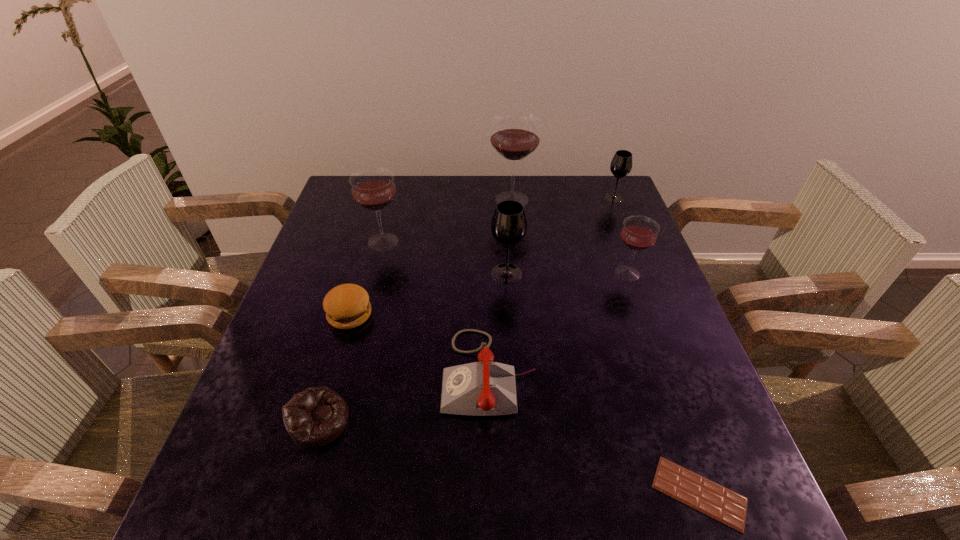
Where is `beanbag present at the left edge`? The height and width of the screenshot is (540, 960). beanbag present at the left edge is located at coordinates (315, 417).

Identify the location of chocolate bar located in the right edge section of the desktop. This screenshot has height=540, width=960. (718, 502).

Identify the location of object at the far right corner. The image size is (960, 540). (621, 164).

Identify the location of object located in the near right corner section of the desktop. (718, 502).

I want to click on vacant space at the far edge, so click(531, 190).

In the image, there is a desktop. At what (x,y) coordinates should I click in order to perform the action: click on vacant space at the left edge. Please return your answer as a coordinate pair (x, y). Image resolution: width=960 pixels, height=540 pixels. Looking at the image, I should click on (293, 327).

The height and width of the screenshot is (540, 960). In order to click on vacant space at the right edge in this screenshot , I will do `click(635, 264)`.

Locate an element on the screen. Image resolution: width=960 pixels, height=540 pixels. vacant space at the far right corner of the desktop is located at coordinates coord(589,200).

I want to click on free spot between the smallest red wineglass and the left gray wineglass, so click(567, 273).

Identify the location of vacant space that is in between the brown beanbag and the brown chocolate bar. (509, 457).